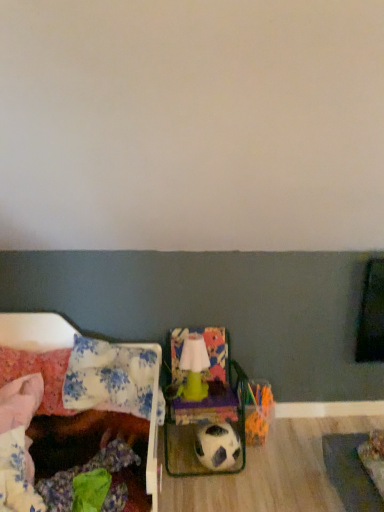
Image resolution: width=384 pixels, height=512 pixels. I want to click on free space to the right of black and white textured football at center, so click(x=266, y=469).